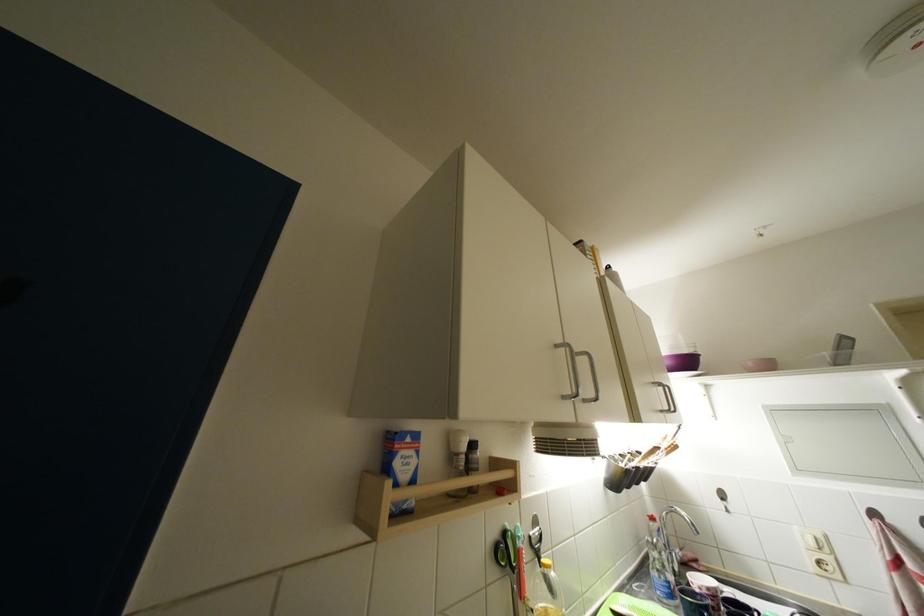
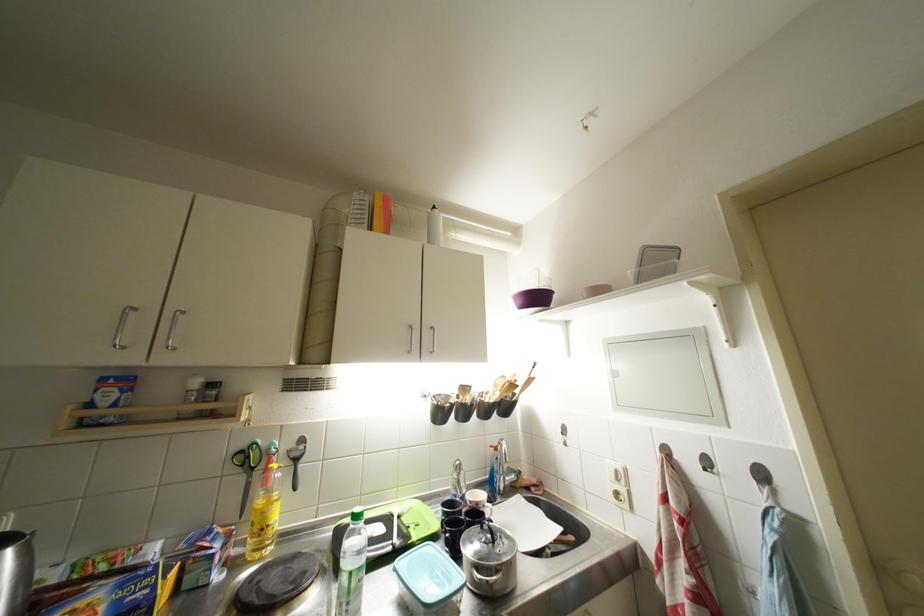
The point at (681, 451) is marked in the first image. Where is the corresponding point in the second image?

(519, 390)